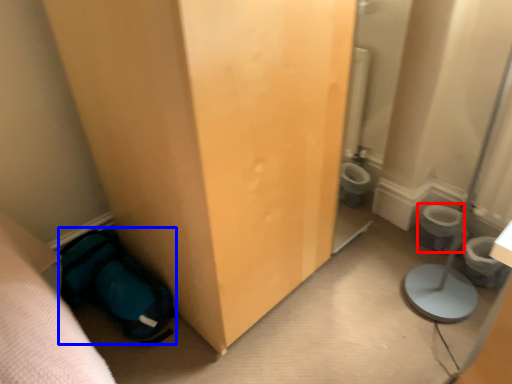
Question: Which of the following is the farthest to the observer, toilet bowl (highlighted by a red box) or sleeping bag (highlighted by a blue box)?

Choices:
 (A) toilet bowl
 (B) sleeping bag

Answer: (A)